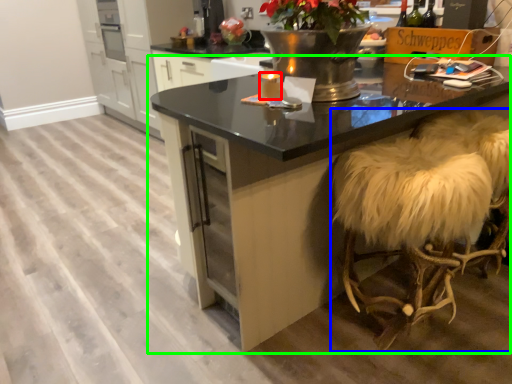
Question: Which object is positioned farthest from candle (highlighted by a red box)? Select from swivel chair (highlighted by a blue box) and table (highlighted by a green box).

Choices:
 (A) swivel chair
 (B) table

Answer: (A)